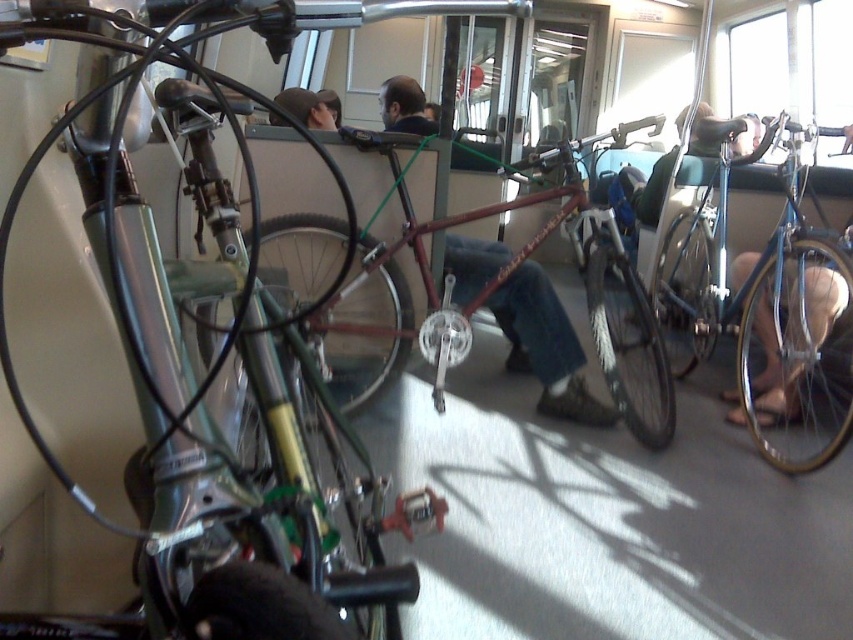
Who is more distant from viewer, (126, 179) or (799, 227)?

The point (799, 227) is behind.

Is point (231, 554) more distant than point (808, 444)?

No, (231, 554) is closer to viewer.

Is point (88, 1) closer to viewer compared to point (781, 394)?

That is True.

Where is `shiny metallic bicycle at center`? shiny metallic bicycle at center is located at coordinates (213, 380).

Can you confirm if shiny red bike at center is positioned above shiny blue bicycle at right?

Correct, shiny red bike at center is located above shiny blue bicycle at right.

Between shiny red bike at center and shiny blue bicycle at right, which one appears on the right side from the viewer's perspective?

shiny blue bicycle at right

Is point (347, 408) less distant than point (791, 320)?

Yes, point (347, 408) is closer to viewer.

This screenshot has height=640, width=853. What are the coordinates of `shiny red bike at center` in the screenshot? It's located at (596, 337).

Does shiny metallic bicycle at center have a greater width compared to shiny red bike at center?

Incorrect, shiny metallic bicycle at center's width does not surpass shiny red bike at center's.

Is shiny metallic bicycle at center positioned at the back of shiny red bike at center?

No, shiny metallic bicycle at center is closer to the viewer.

Is point (155, 282) closer to viewer compared to point (514, 332)?

Yes, it is.

This screenshot has height=640, width=853. I want to click on shiny metallic bicycle at center, so click(213, 380).